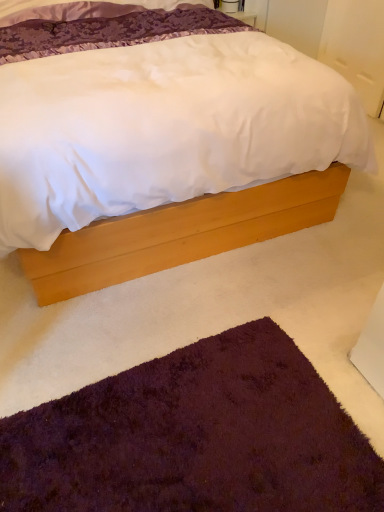
Question: Is light wood bed at center smaller than purple shaggy rug at lower left?

Choices:
 (A) no
 (B) yes

Answer: (A)

Question: Is the depth of light wood bed at center greater than that of purple shaggy rug at lower left?

Choices:
 (A) yes
 (B) no

Answer: (B)

Question: Is light wood bed at center turned away from purple shaggy rug at lower left?

Choices:
 (A) yes
 (B) no

Answer: (B)

Question: Does light wood bed at center appear on the right side of purple shaggy rug at lower left?

Choices:
 (A) no
 (B) yes

Answer: (A)

Question: Is light wood bed at center bigger than purple shaggy rug at lower left?

Choices:
 (A) no
 (B) yes

Answer: (B)

Question: Considering the relative sizes of light wood bed at center and purple shaggy rug at lower left in the image provided, is light wood bed at center wider than purple shaggy rug at lower left?

Choices:
 (A) yes
 (B) no

Answer: (A)

Question: Considering the relative sizes of purple shaggy rug at lower left and light wood bed at center in the image provided, is purple shaggy rug at lower left thinner than light wood bed at center?

Choices:
 (A) yes
 (B) no

Answer: (A)

Question: Is purple shaggy rug at lower left with light wood bed at center?

Choices:
 (A) yes
 (B) no

Answer: (B)

Question: Does purple shaggy rug at lower left have a greater height compared to light wood bed at center?

Choices:
 (A) no
 (B) yes

Answer: (A)

Question: From a real-world perspective, is purple shaggy rug at lower left located higher than light wood bed at center?

Choices:
 (A) yes
 (B) no

Answer: (B)

Question: Is purple shaggy rug at lower left outside light wood bed at center?

Choices:
 (A) no
 (B) yes

Answer: (B)

Question: From the image's perspective, is purple shaggy rug at lower left below light wood bed at center?

Choices:
 (A) no
 (B) yes

Answer: (B)

Question: Does point (215, 222) appear closer or farther from the camera than point (337, 421)?

Choices:
 (A) farther
 (B) closer

Answer: (A)